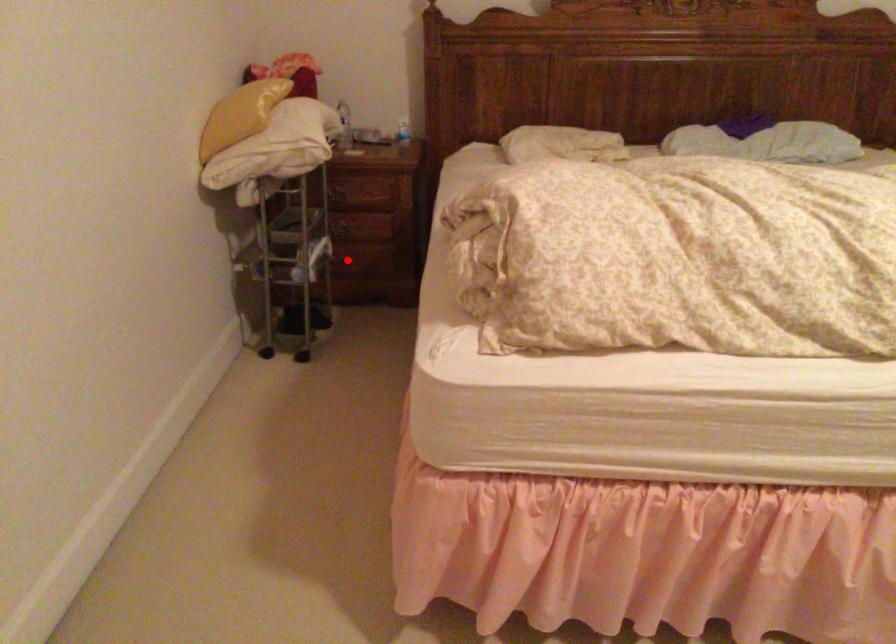
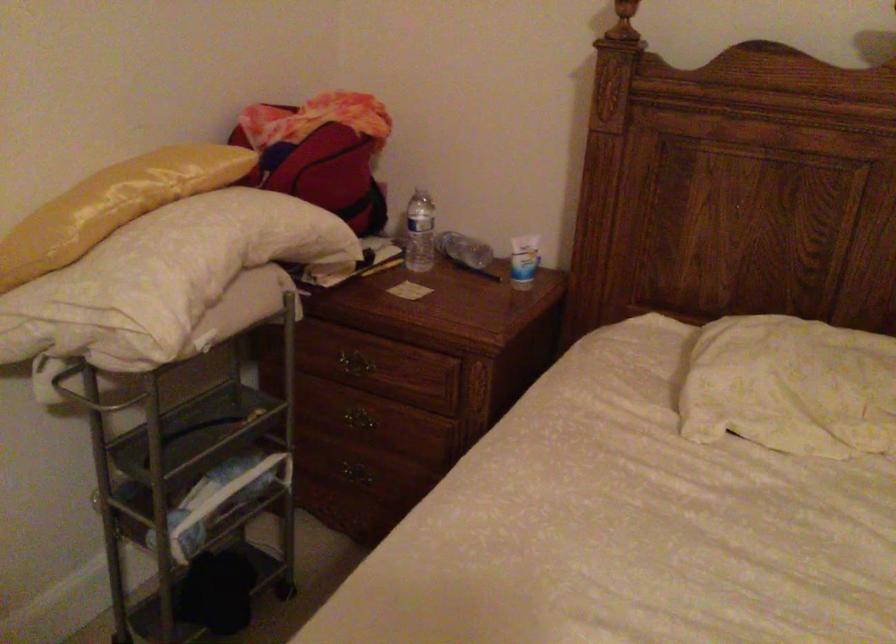
Question: I am providing you with two images of the same scene from different viewpoints. A red point is shown in image1. For the corresponding object point in image2, is it positioned nearer or farther from the camera?

Choices:
 (A) Nearer
 (B) Farther

Answer: (A)